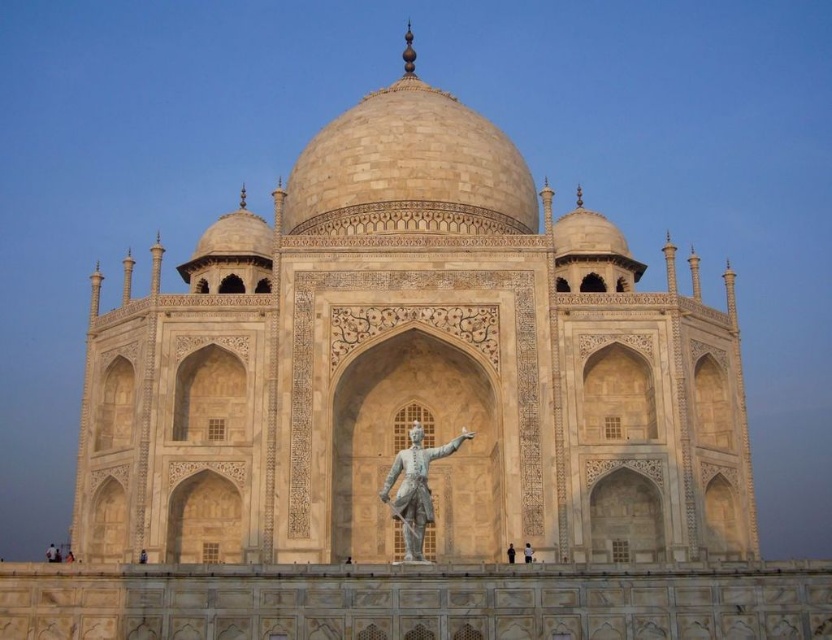
Question: Estimate the real-world distances between objects in this image. Which object is farther from the beige stone taj mahal at center?

Choices:
 (A) black statue at center
 (B) polished bronze statue at center
 (C) dark brown wooden statue at center
 (D) smooth white statue at center

Answer: (C)

Question: Which object is the farthest from the polished bronze statue at center?

Choices:
 (A) dark brown wooden statue at center
 (B) beige stone taj mahal at center

Answer: (A)

Question: Which is nearer to the dark brown wooden statue at center?

Choices:
 (A) smooth white statue at center
 (B) black statue at center
 (C) beige stone taj mahal at center

Answer: (C)

Question: From the image, what is the correct spatial relationship of polished bronze statue at center in relation to dark brown wooden statue at center?

Choices:
 (A) right
 (B) left

Answer: (A)

Question: Does beige stone taj mahal at center have a larger size compared to smooth white statue at center?

Choices:
 (A) no
 (B) yes

Answer: (B)

Question: Is beige stone taj mahal at center in front of black statue at center?

Choices:
 (A) no
 (B) yes

Answer: (A)